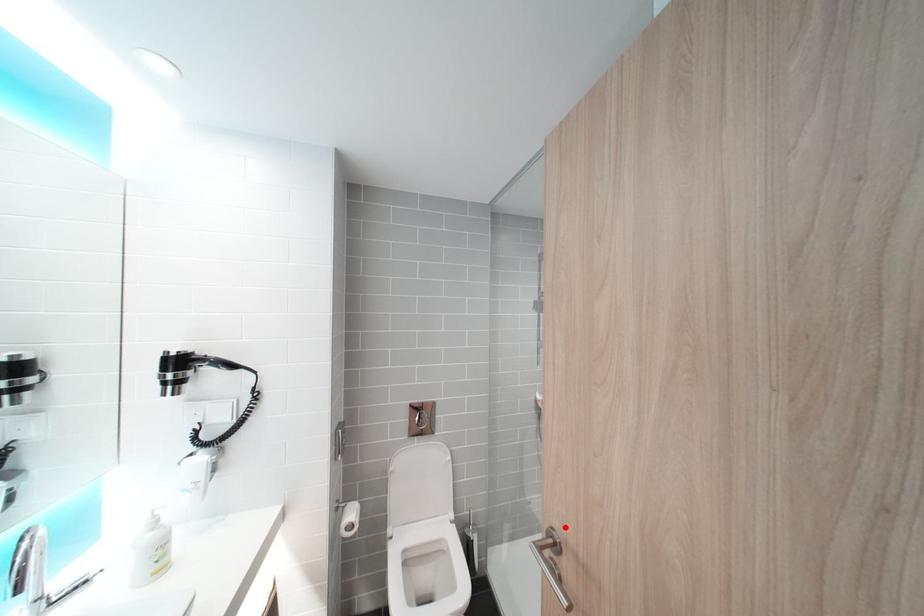
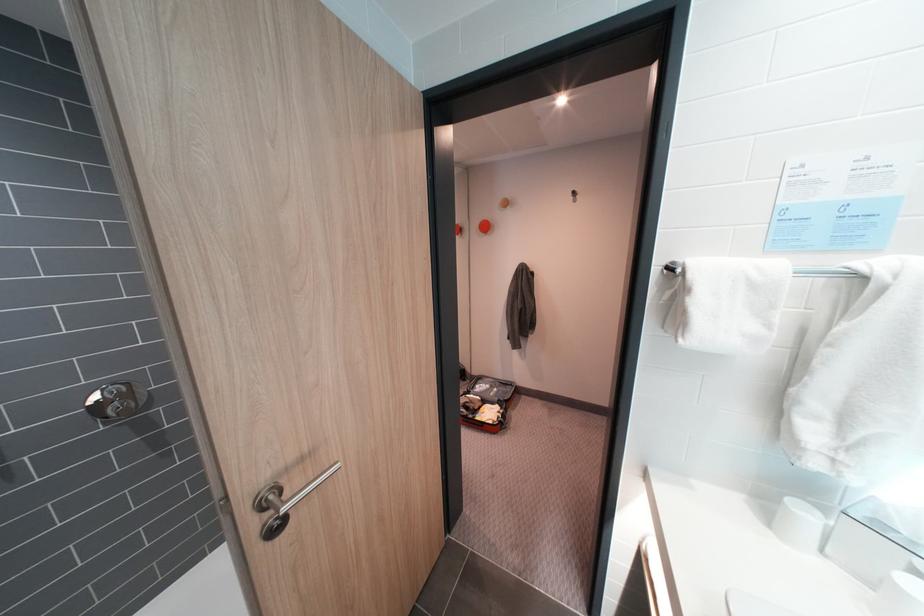
The point at the highlighted location is marked in the first image. Where is the corresponding point in the second image?

(274, 488)